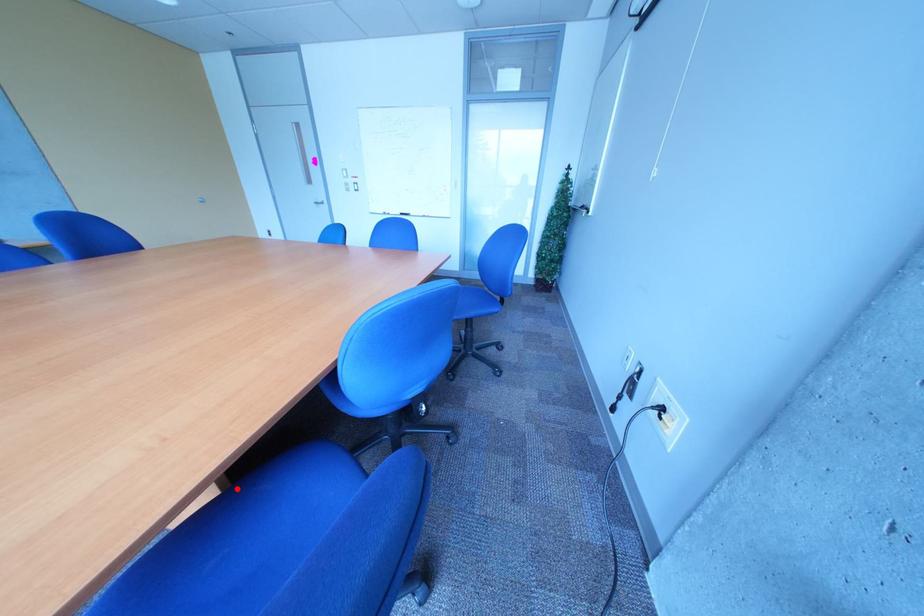
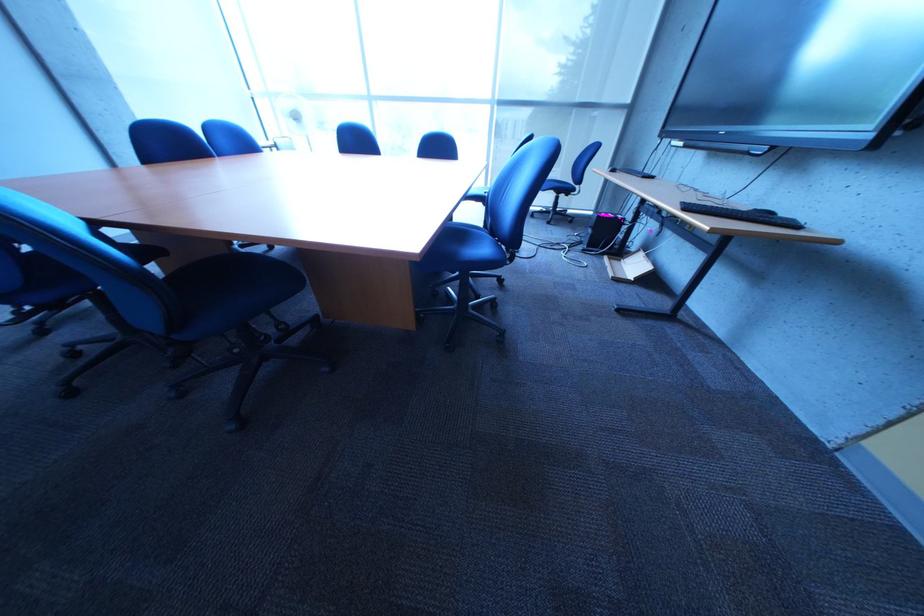
Question: I am providing you with two images of the same scene from different viewpoints. A red point is marked on the first image. Is the red point's position out of view in image 2?

Choices:
 (A) Yes
 (B) No

Answer: (A)